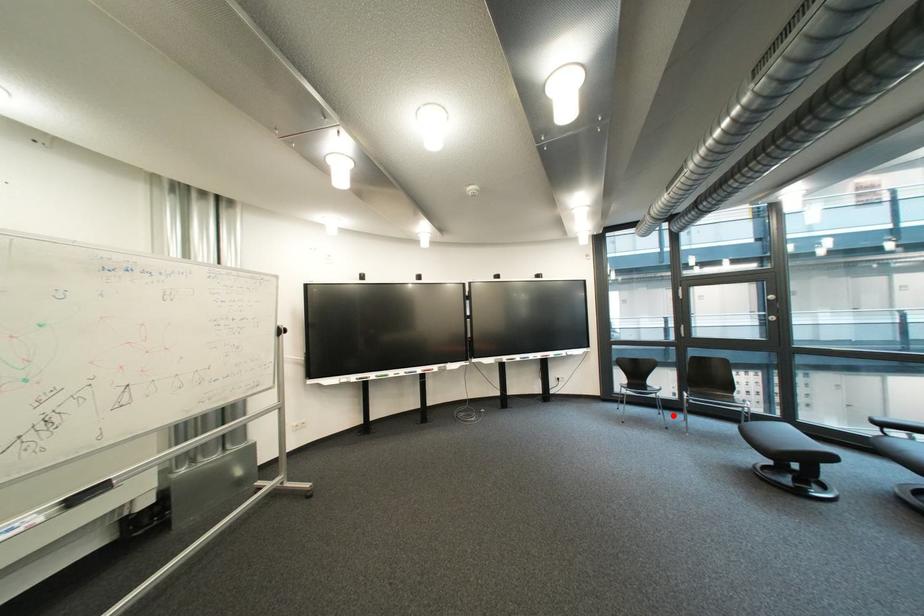
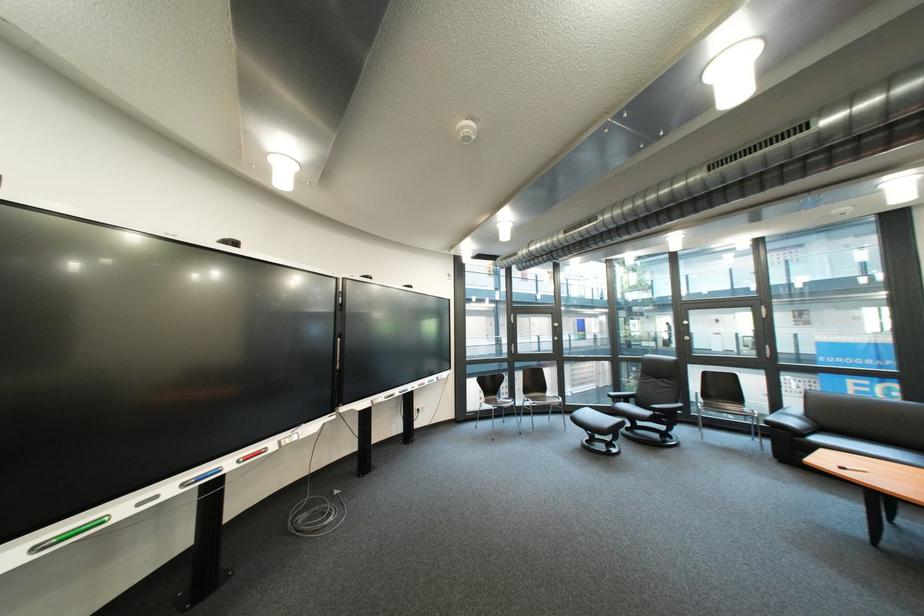
Question: I am providing you with two images of the same scene from different viewpoints. A red point is marked on the first image. At the location where the point appears in image 1, is it still visible in image 2?

Choices:
 (A) Yes
 (B) No

Answer: (A)